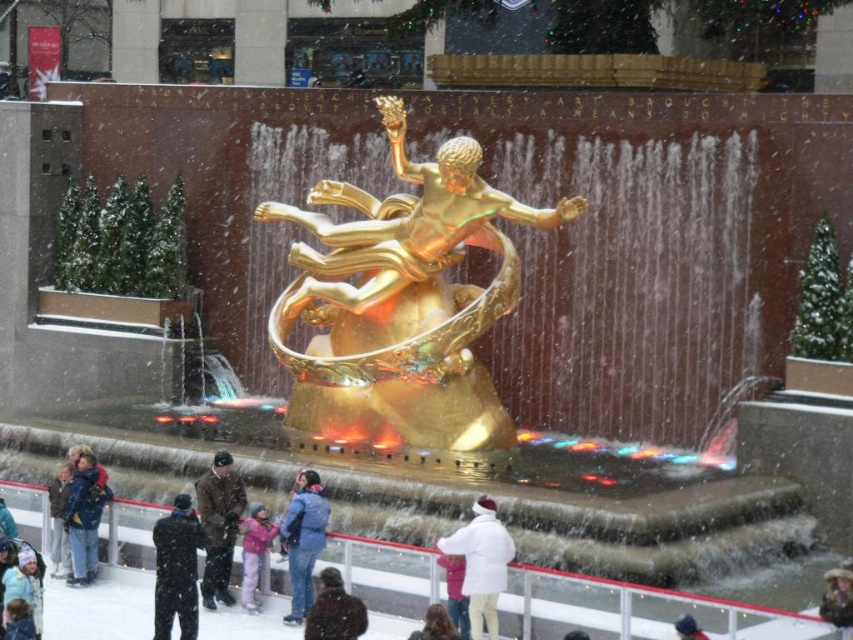
Question: Can you confirm if dark brown fur coat at lower center is smaller than light purple fleece jacket at center?

Choices:
 (A) yes
 (B) no

Answer: (A)

Question: Which of these objects is positioned farthest from the matte blue jacket at center?

Choices:
 (A) light purple fleece jacket at center
 (B) dark brown fur coat at lower center
 (C) light pink knit hat at lower left

Answer: (C)

Question: Which of these objects is positioned farthest from the matte blue jacket at center?

Choices:
 (A) matte pink coat at lower center
 (B) brown woolen hat at center
 (C) gold polished statue at center
 (D) black wool jacket at center

Answer: (C)

Question: Does black wool jacket at center appear on the right side of light pink knit hat at lower left?

Choices:
 (A) no
 (B) yes

Answer: (B)

Question: Which of the following is the closest to the observer?

Choices:
 (A) (445, 572)
 (B) (51, 548)
 (C) (848, 577)

Answer: (C)

Question: Is gold polished statue at center wider than light purple fleece jacket at center?

Choices:
 (A) yes
 (B) no

Answer: (A)